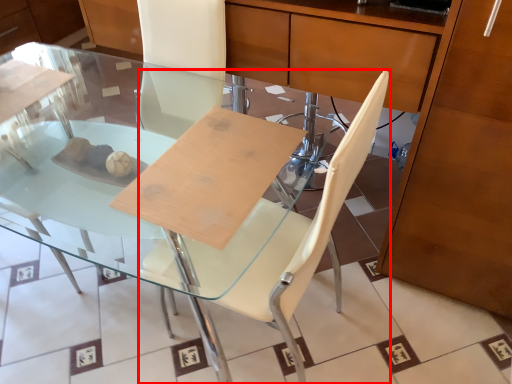
Question: From the image's perspective, where is chair (annotated by the red box) located relative to table?

Choices:
 (A) above
 (B) below

Answer: (B)